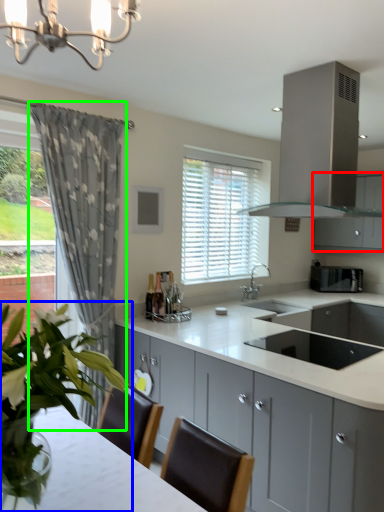
Question: Which object is the farthest from cabinetry (highlighted by a red box)? Choose among these: houseplant (highlighted by a blue box) or curtain (highlighted by a green box).

Choices:
 (A) houseplant
 (B) curtain

Answer: (A)